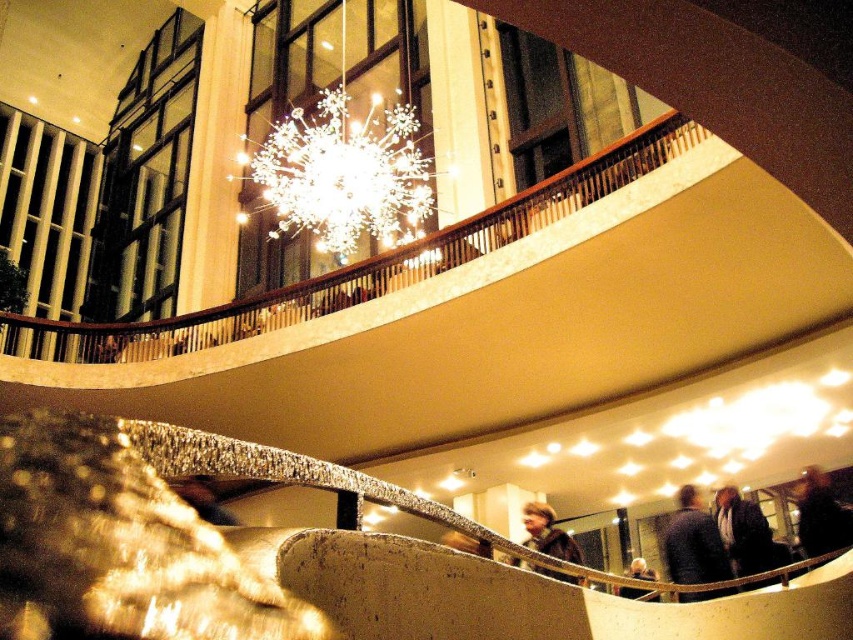
You are a guest at the hotel and see both the dark brown leather jacket at lower right and the light brown leather jacket at lower center. Which jacket is positioned to the right side of the other?

The dark brown leather jacket at lower right is positioned to the right of the light brown leather jacket at lower center.